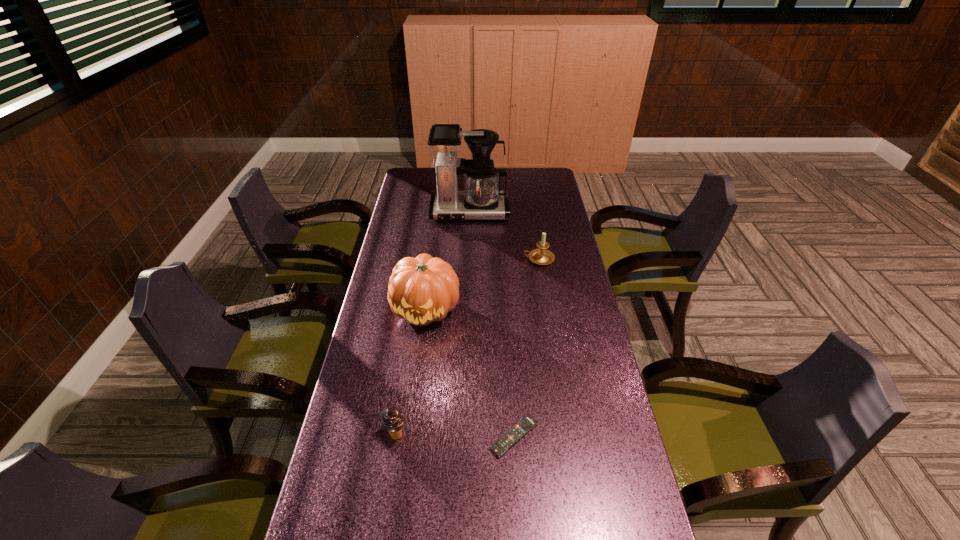
In the image, there is a desktop. Identify the location of blank space at the left edge. (354, 433).

At what (x,y) coordinates should I click in order to perform the action: click on free space at the right edge. Please return your answer as a coordinate pair (x, y). This screenshot has width=960, height=540. Looking at the image, I should click on (621, 498).

You are a GUI agent. You are given a task and a screenshot of the screen. Output one action in this format:
    pyautogui.click(x=<x>, y=<y>)
    Task: Click on the vacant space at the far left corner of the desktop
    
    Given the screenshot: What is the action you would take?
    pyautogui.click(x=435, y=184)

Locate an element on the screen. vacant region between the remote control and the icecream is located at coordinates (455, 436).

You are a GUI agent. You are given a task and a screenshot of the screen. Output one action in this format:
    pyautogui.click(x=<x>, y=<y>)
    Task: Click on the empty location between the remote control and the icecream
    The image size is (960, 540).
    Given the screenshot: What is the action you would take?
    pyautogui.click(x=455, y=436)

Where is `free space that is in between the remote control and the rightmost object`? free space that is in between the remote control and the rightmost object is located at coordinates (527, 348).

This screenshot has height=540, width=960. I want to click on empty space between the second tallest object and the farthest object, so click(447, 260).

Identify the location of vacant region between the icecream and the tallest object. The height and width of the screenshot is (540, 960). (433, 323).

Identify the location of free point between the remote control and the icecream. (455, 436).

You are a GUI agent. You are given a task and a screenshot of the screen. Output one action in this format:
    pyautogui.click(x=<x>, y=<y>)
    Task: Click on the unoccupied position between the remote control and the second tallest object
    This screenshot has width=960, height=540.
    Given the screenshot: What is the action you would take?
    pyautogui.click(x=470, y=373)